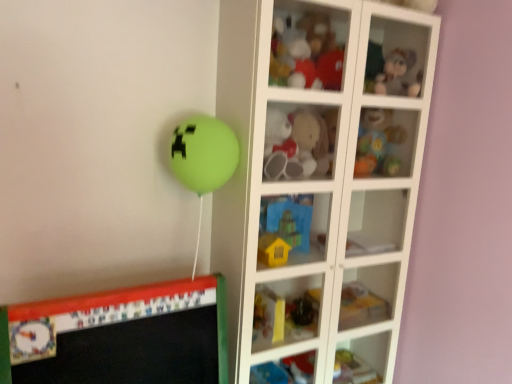
The width and height of the screenshot is (512, 384). In order to click on yellow matte house at center, which appears as the 5th toy when viewed from the top in this screenshot , I will do `click(272, 250)`.

What is the approximate width of yellow matte house at center, which appears as the 5th toy when viewed from the top?

yellow matte house at center, which appears as the 5th toy when viewed from the top, is 4.60 inches wide.

Describe the element at coordinates (298, 144) in the screenshot. I see `fluffy plush toy at center, placed as the third toy when sorted from top to bottom` at that location.

Where is `matte plastic cabinet at lower center, the second cabinet when ordered from right to left`? matte plastic cabinet at lower center, the second cabinet when ordered from right to left is located at coordinates (285, 370).

What do you see at coordinates (285, 370) in the screenshot?
I see `matte plastic cabinet at lower center, the first cabinet positioned from the left` at bounding box center [285, 370].

What do you see at coordinates (395, 58) in the screenshot?
I see `fuzzy fabric plush toy at upper right, placed as the 1th cabinet when sorted from right to left` at bounding box center [395, 58].

How much space does fuzzy fabric plush toy at upper right, which appears as the 1th cabinet when viewed from the top, occupy vertically?

fuzzy fabric plush toy at upper right, which appears as the 1th cabinet when viewed from the top, is 8.41 inches tall.

Describe the element at coordinates (378, 143) in the screenshot. The height and width of the screenshot is (384, 512). I see `rubberized plastic baby rattle at upper right, which is the second toy in top-to-bottom order` at that location.

What do you see at coordinates (319, 172) in the screenshot? Image resolution: width=512 pixels, height=384 pixels. I see `white glass cabinet at center` at bounding box center [319, 172].

You are a GUI agent. You are given a task and a screenshot of the screen. Output one action in this format:
    pyautogui.click(x=<x>, y=<y>)
    Task: Click on the yellow matte house at center, which appears as the 5th toy when viewed from the top
    
    Given the screenshot: What is the action you would take?
    pyautogui.click(x=272, y=250)

What's the angular difference between rubberized plastic baby rattle at upper right, which is the second toy in top-to-bottom order, and fluffy plush toy at center, placed as the third toy when sorted from top to bottom,'s facing directions?

The facing directions of rubberized plastic baby rattle at upper right, which is the second toy in top-to-bottom order, and fluffy plush toy at center, placed as the third toy when sorted from top to bottom, are 2.17 degrees apart.

Can you confirm if rubberized plastic baby rattle at upper right, positioned as the 5th toy in bottom-to-top order, is taller than fluffy plush toy at center, placed as the third toy when sorted from top to bottom?

No.

From the picture: Considering the relative positions of rubberized plastic baby rattle at upper right, positioned as the 5th toy in bottom-to-top order, and fluffy plush toy at center, placed as the third toy when sorted from top to bottom, in the image provided, is rubberized plastic baby rattle at upper right, positioned as the 5th toy in bottom-to-top order, to the left of fluffy plush toy at center, placed as the third toy when sorted from top to bottom, from the viewer's perspective?

No, rubberized plastic baby rattle at upper right, positioned as the 5th toy in bottom-to-top order, is not to the left of fluffy plush toy at center, placed as the third toy when sorted from top to bottom.

Does point (382, 162) lie in front of point (308, 164)?

No, it is behind (308, 164).

Based on the photo, which is in front, rubberized plastic toy at lower center, which is counted as the 1th toy, starting from the bottom, or rubberized plastic baby rattle at upper right, which is the second toy in top-to-bottom order?

rubberized plastic toy at lower center, which is counted as the 1th toy, starting from the bottom, is closer to the camera.

In order to click on toy that is the 2nd one when counting leftward from the rubberized plastic baby rattle at upper right, which is the second toy in top-to-bottom order in this screenshot , I will do `click(302, 316)`.

How many degrees apart are the facing directions of rubberized plastic toy at lower center, which is counted as the 1th toy, starting from the bottom, and rubberized plastic baby rattle at upper right, which is the second toy in top-to-bottom order?

The facing directions of rubberized plastic toy at lower center, which is counted as the 1th toy, starting from the bottom, and rubberized plastic baby rattle at upper right, which is the second toy in top-to-bottom order, are 2.81 degrees apart.

Is point (315, 309) positioned behind point (359, 130)?

Yes, point (315, 309) is farther from viewer.

Which of these two, fluffy plush toy at center, placed as the third toy when sorted from top to bottom, or rubberized plastic baby rattle at upper right, positioned as the 5th toy in bottom-to-top order, is thinner?

fluffy plush toy at center, placed as the third toy when sorted from top to bottom.

From a real-world perspective, is fluffy plush toy at center, marked as the 4th toy in a bottom-to-top arrangement, positioned above or below rubberized plastic baby rattle at upper right, which is the second toy in top-to-bottom order?

fluffy plush toy at center, marked as the 4th toy in a bottom-to-top arrangement, is above rubberized plastic baby rattle at upper right, which is the second toy in top-to-bottom order.

Are fluffy plush toy at center, placed as the third toy when sorted from top to bottom, and rubberized plastic baby rattle at upper right, positioned as the 5th toy in bottom-to-top order, far apart?

fluffy plush toy at center, placed as the third toy when sorted from top to bottom, is actually quite close to rubberized plastic baby rattle at upper right, positioned as the 5th toy in bottom-to-top order.

Does fluffy plush toy at center, marked as the 4th toy in a bottom-to-top arrangement, have a greater height compared to rubberized plastic baby rattle at upper right, positioned as the 5th toy in bottom-to-top order?

Correct, fluffy plush toy at center, marked as the 4th toy in a bottom-to-top arrangement, is much taller as rubberized plastic baby rattle at upper right, positioned as the 5th toy in bottom-to-top order.

Find the location of a particular element. This screenshot has height=384, width=512. toy below the yellow matte house at center, the 2th toy when ordered from bottom to top (from the image's perspective) is located at coordinates (302, 316).

Considering the relative positions of yellow matte house at center, the 2th toy when ordered from bottom to top, and rubberized plastic toy at lower center, placed as the 6th toy when sorted from top to bottom, in the image provided, is yellow matte house at center, the 2th toy when ordered from bottom to top, in front of rubberized plastic toy at lower center, placed as the 6th toy when sorted from top to bottom,?

Yes, yellow matte house at center, the 2th toy when ordered from bottom to top, is closer to the camera.

Considering the positions of points (264, 233) and (311, 312), is point (264, 233) farther from camera compared to point (311, 312)?

That is False.

How many degrees apart are the facing directions of yellow matte house at center, which appears as the 5th toy when viewed from the top, and rubberized plastic toy at lower center, which is counted as the 1th toy, starting from the bottom?

3.64 degrees.

Does yellow matte house at center, the 2th toy when ordered from bottom to top, lie behind white glass cabinet at center?

Yes, yellow matte house at center, the 2th toy when ordered from bottom to top, is behind white glass cabinet at center.

Is yellow matte house at center, the 2th toy when ordered from bottom to top, located outside white glass cabinet at center?

No, most part of yellow matte house at center, the 2th toy when ordered from bottom to top, lies within white glass cabinet at center.

Does yellow matte house at center, the 2th toy when ordered from bottom to top, have a larger size compared to white glass cabinet at center?

No.

Is yellow matte house at center, the 2th toy when ordered from bottom to top, turned away from white glass cabinet at center?

Yes.

Considering the sizes of objects fluffy plush toy at center, placed as the third toy when sorted from top to bottom, and blue fabric toy at center, the fourth toy viewed from the top, in the image provided, who is smaller, fluffy plush toy at center, placed as the third toy when sorted from top to bottom, or blue fabric toy at center, the fourth toy viewed from the top,?

blue fabric toy at center, the fourth toy viewed from the top, is smaller.

Which object is positioned more to the right, fluffy plush toy at center, marked as the 4th toy in a bottom-to-top arrangement, or blue fabric toy at center, the fourth toy viewed from the top?

Positioned to the right is fluffy plush toy at center, marked as the 4th toy in a bottom-to-top arrangement.

Is fluffy plush toy at center, placed as the third toy when sorted from top to bottom, inside or outside of blue fabric toy at center, the 3th toy in the bottom-to-top sequence?

fluffy plush toy at center, placed as the third toy when sorted from top to bottom, is located beyond the bounds of blue fabric toy at center, the 3th toy in the bottom-to-top sequence.

Is fluffy plush toy at center, marked as the 4th toy in a bottom-to-top arrangement, oriented towards blue fabric toy at center, the 3th toy in the bottom-to-top sequence?

No.

Could you tell me if blue fabric toy at center, the fourth toy viewed from the top, is turned towards matte plastic teddy bear at upper center, the first toy positioned from the top?

No.

Consider the image. Is blue fabric toy at center, the fourth toy viewed from the top, not within matte plastic teddy bear at upper center, the first toy positioned from the top?

That's correct, blue fabric toy at center, the fourth toy viewed from the top, is outside of matte plastic teddy bear at upper center, the first toy positioned from the top.

Which of these two, blue fabric toy at center, the fourth toy viewed from the top, or matte plastic teddy bear at upper center, the sixth toy when ordered from bottom to top, is bigger?

With larger size is blue fabric toy at center, the fourth toy viewed from the top.

Can you tell me how much blue fabric toy at center, the 3th toy in the bottom-to-top sequence, and matte plastic teddy bear at upper center, the sixth toy when ordered from bottom to top, differ in facing direction?

2.76 degrees.

This screenshot has width=512, height=384. There is a fluffy plush toy at center, marked as the 4th toy in a bottom-to-top arrangement. What are the coordinates of `the 1st toy above it (from the image's perspective)` in the screenshot? It's located at (378, 143).

Locate an element on the screen. Image resolution: width=512 pixels, height=384 pixels. the 1st toy in front of the rubberized plastic baby rattle at upper right, positioned as the 5th toy in bottom-to-top order, starting your count from the anchor is located at coordinates (302, 316).

When comparing their distances from white glass cabinet at center, does blue fabric toy at center, the fourth toy viewed from the top, or yellow matte house at center, the 2th toy when ordered from bottom to top, seem further?

Among the two, yellow matte house at center, the 2th toy when ordered from bottom to top, is located further to white glass cabinet at center.

When comparing their distances from matte plastic teddy bear at upper center, the sixth toy when ordered from bottom to top, does rubberized plastic baby rattle at upper right, positioned as the 5th toy in bottom-to-top order, or matte plastic cabinet at lower center, the second cabinet when ordered from right to left, seem further?

matte plastic cabinet at lower center, the second cabinet when ordered from right to left, is positioned further to the anchor matte plastic teddy bear at upper center, the sixth toy when ordered from bottom to top.

Estimate the real-world distances between objects in this image. Which object is further from rubberized plastic toy at lower center, placed as the 6th toy when sorted from top to bottom, fluffy plush toy at center, marked as the 4th toy in a bottom-to-top arrangement, or matte plastic cabinet at lower center, the first cabinet positioned from the left?

Based on the image, fluffy plush toy at center, marked as the 4th toy in a bottom-to-top arrangement, appears to be further to rubberized plastic toy at lower center, placed as the 6th toy when sorted from top to bottom.

Estimate the real-world distances between objects in this image. Which object is further from fuzzy fabric plush toy at upper right, which appears as the 1th cabinet when viewed from the top, rubberized plastic baby rattle at upper right, which is the second toy in top-to-bottom order, or yellow matte house at center, which appears as the 5th toy when viewed from the top?

Based on the image, yellow matte house at center, which appears as the 5th toy when viewed from the top, appears to be further to fuzzy fabric plush toy at upper right, which appears as the 1th cabinet when viewed from the top.

Estimate the real-world distances between objects in this image. Which object is further from matte plastic cabinet at lower center, the second cabinet when ordered from right to left, rubberized plastic toy at lower center, placed as the 6th toy when sorted from top to bottom, or matte plastic teddy bear at upper center, the sixth toy when ordered from bottom to top?

Among the two, matte plastic teddy bear at upper center, the sixth toy when ordered from bottom to top, is located further to matte plastic cabinet at lower center, the second cabinet when ordered from right to left.

Estimate the real-world distances between objects in this image. Which object is further from matte plastic cabinet at lower center, the 1th cabinet positioned from the bottom, yellow matte house at center, the 2th toy when ordered from bottom to top, or blue fabric toy at center, the fourth toy viewed from the top?

blue fabric toy at center, the fourth toy viewed from the top.

Which object lies further to the anchor point white glass cabinet at center, matte plastic cabinet at lower center, the second cabinet when ordered from right to left, or fluffy plush toy at center, marked as the 4th toy in a bottom-to-top arrangement?

matte plastic cabinet at lower center, the second cabinet when ordered from right to left.

Looking at the image, which one is located further to matte plastic cabinet at lower center, the 1th cabinet positioned from the bottom, white glass cabinet at center or rubberized plastic baby rattle at upper right, which is the second toy in top-to-bottom order?

rubberized plastic baby rattle at upper right, which is the second toy in top-to-bottom order, is further to matte plastic cabinet at lower center, the 1th cabinet positioned from the bottom.

Locate an element on the screen. This screenshot has width=512, height=384. toy between fluffy plush toy at center, marked as the 4th toy in a bottom-to-top arrangement, and yellow matte house at center, the 2th toy when ordered from bottom to top, in the vertical direction is located at coordinates (288, 219).

Locate an element on the screen. cabinet between matte plastic teddy bear at upper center, the first toy positioned from the top, and matte plastic cabinet at lower center, the second cabinet when ordered from right to left, from top to bottom is located at coordinates (395, 58).

Where is `cabinet that lies between matte plastic teddy bear at upper center, the sixth toy when ordered from bottom to top, and yellow matte house at center, which appears as the 5th toy when viewed from the top, from top to bottom`? The width and height of the screenshot is (512, 384). cabinet that lies between matte plastic teddy bear at upper center, the sixth toy when ordered from bottom to top, and yellow matte house at center, which appears as the 5th toy when viewed from the top, from top to bottom is located at coordinates (395, 58).

Locate an element on the screen. This screenshot has height=384, width=512. shelf between fluffy plush toy at center, placed as the third toy when sorted from top to bottom, and yellow matte house at center, which appears as the 5th toy when viewed from the top, in the up-down direction is located at coordinates (319, 172).